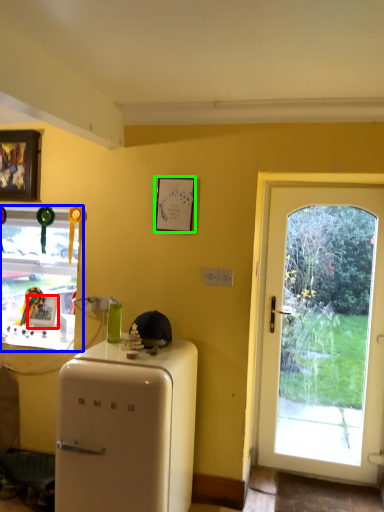
Question: Which object is positioned closest to picture frame (highlighted by a red box)? Select from window (highlighted by a blue box) and picture frame (highlighted by a green box).

Choices:
 (A) window
 (B) picture frame

Answer: (A)